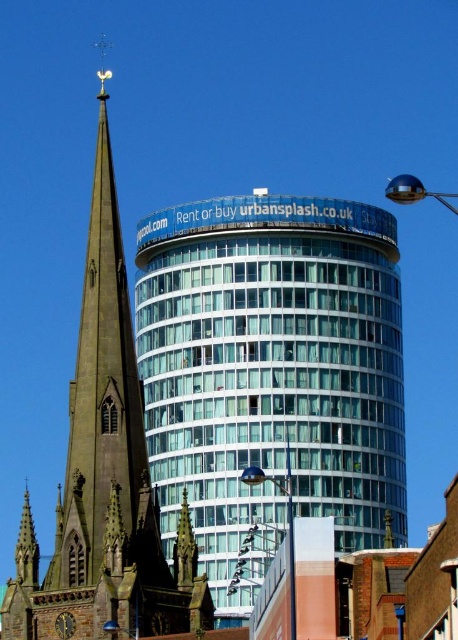
Question: Can you confirm if clear glass building at center is positioned below smooth stone spire at left?

Choices:
 (A) no
 (B) yes

Answer: (A)

Question: Which point is farther to the camera?

Choices:
 (A) dark brown wooden clock at center-left
 (B) smooth stone spire at left
 (C) clear glass building at center

Answer: (C)

Question: Can you confirm if clear glass building at center is positioned below smooth stone spire at left?

Choices:
 (A) yes
 (B) no

Answer: (B)

Question: Estimate the real-world distances between objects in this image. Which object is closer to the clear glass building at center?

Choices:
 (A) smooth stone spire at left
 (B) dark brown wooden clock at center-left

Answer: (A)

Question: Which object is closer to the camera taking this photo?

Choices:
 (A) dark brown wooden clock at center-left
 (B) clear glass building at center
 (C) smooth stone spire at left

Answer: (C)

Question: Is clear glass building at center to the left of dark brown wooden clock at center-left from the viewer's perspective?

Choices:
 (A) no
 (B) yes

Answer: (A)